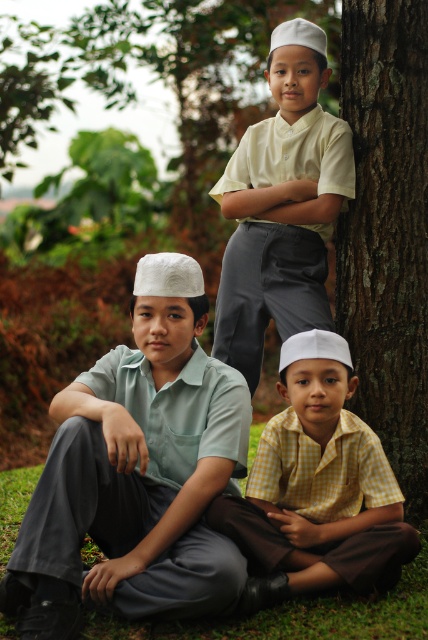
Who is more forward, (344, 38) or (398, 630)?

Positioned in front is point (398, 630).

This screenshot has width=428, height=640. What do you see at coordinates (386, 230) in the screenshot?
I see `smooth bark tree at right` at bounding box center [386, 230].

Is point (404, 381) positioned behind point (333, 605)?

Yes, point (404, 381) is behind point (333, 605).

Where is `smooth bark tree at right`? smooth bark tree at right is located at coordinates (386, 230).

Who is higher up, matte yellow shirt at upper center or green grass at lower center?

matte yellow shirt at upper center is higher up.

Between matte yellow shirt at upper center and green grass at lower center, which one appears on the right side from the viewer's perspective?

From the viewer's perspective, matte yellow shirt at upper center appears more on the right side.

Describe the element at coordinates (282, 205) in the screenshot. I see `matte yellow shirt at upper center` at that location.

Where is `matte yellow shirt at upper center`? Image resolution: width=428 pixels, height=640 pixels. matte yellow shirt at upper center is located at coordinates (282, 205).

Can you confirm if smooth bark tree at right is positioned to the right of matte yellow shirt at upper center?

Yes, smooth bark tree at right is to the right of matte yellow shirt at upper center.

This screenshot has height=640, width=428. What do you see at coordinates (386, 230) in the screenshot?
I see `smooth bark tree at right` at bounding box center [386, 230].

Does point (401, 253) come in front of point (294, 147)?

That is True.

This screenshot has height=640, width=428. I want to click on smooth bark tree at right, so click(x=386, y=230).